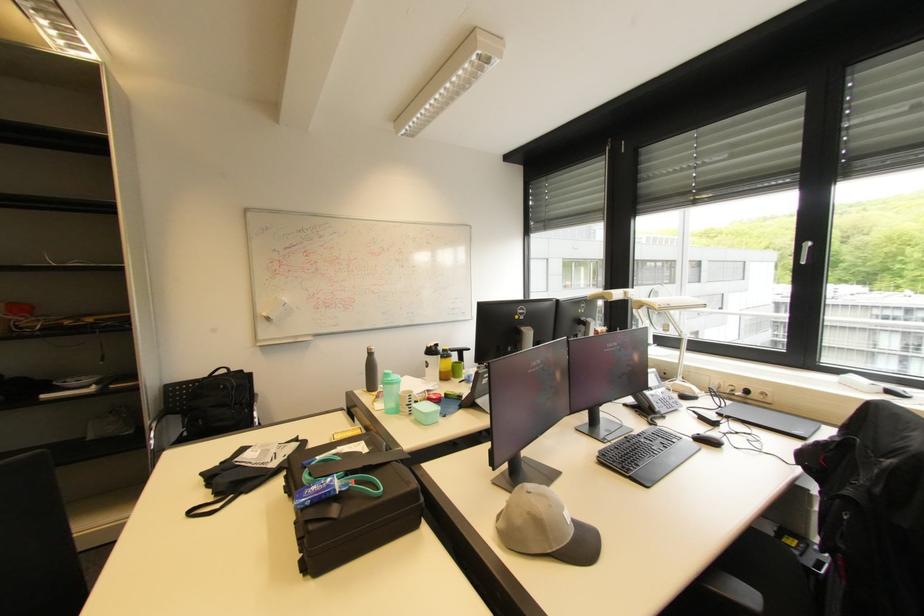
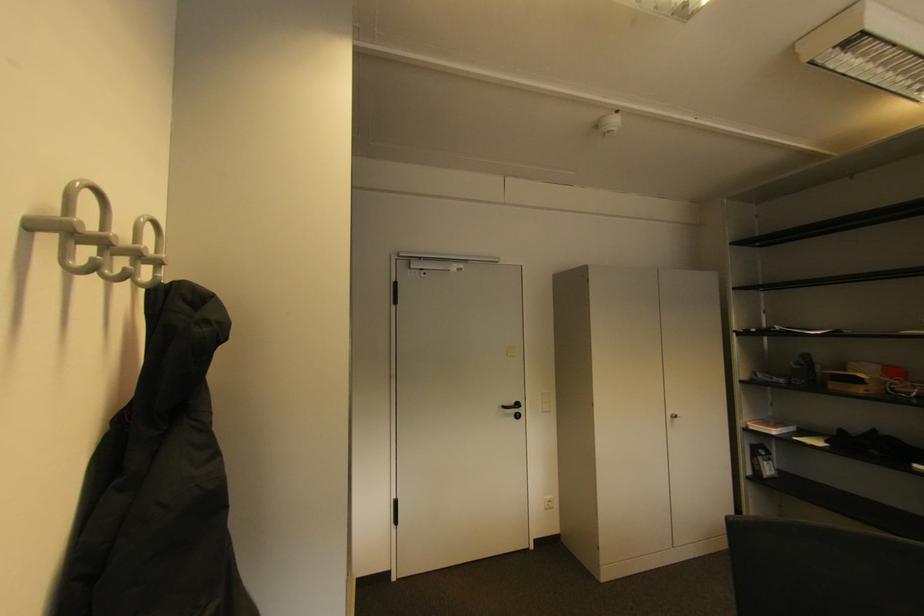
Question: The first image is from the beginning of the video and the second image is from the end. How did the camera likely rotate when shooting the video?

Choices:
 (A) Left
 (B) Right
 (C) Up
 (D) Down

Answer: (A)